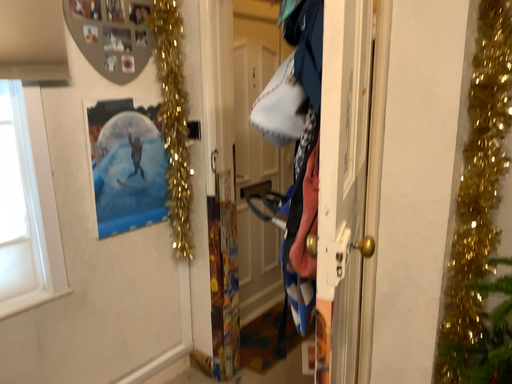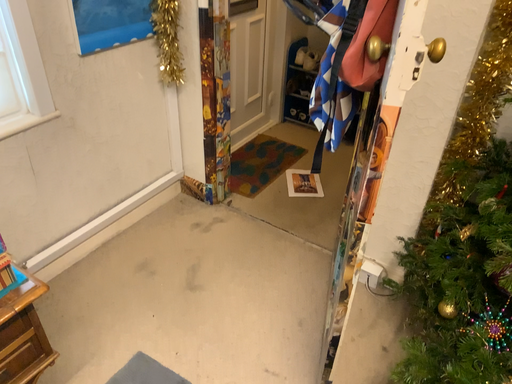
Question: How did the camera likely rotate when shooting the video?

Choices:
 (A) rotated left
 (B) rotated right

Answer: (B)